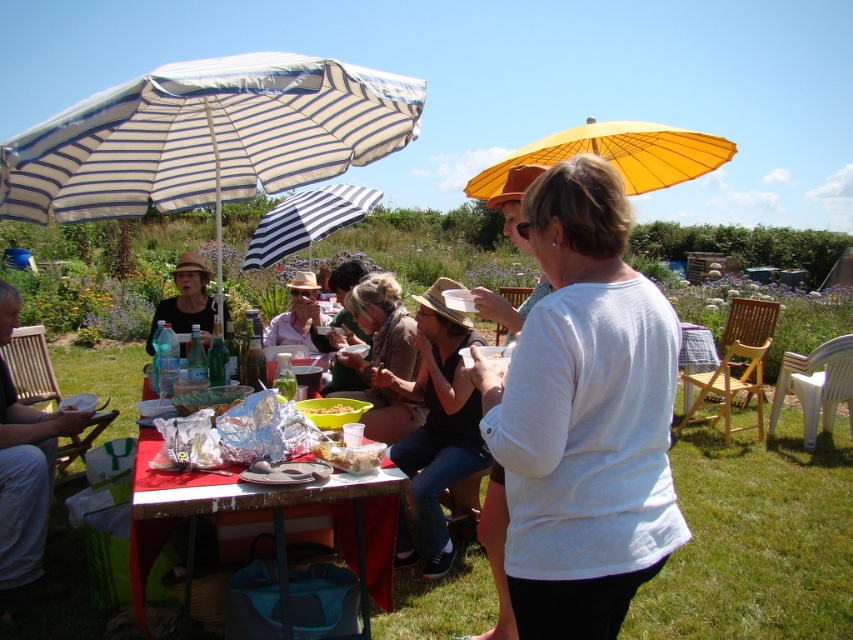
Is striped fabric umbrella at center further to the viewer compared to yellow plastic bowl at center?

Yes, striped fabric umbrella at center is further from the viewer.

Can you confirm if striped fabric umbrella at center is shorter than yellow plastic bowl at center?

In fact, striped fabric umbrella at center may be taller than yellow plastic bowl at center.

This screenshot has width=853, height=640. Describe the element at coordinates (306, 220) in the screenshot. I see `striped fabric umbrella at center` at that location.

Locate an element on the screen. The height and width of the screenshot is (640, 853). striped fabric umbrella at center is located at coordinates (306, 220).

From the picture: Can you confirm if denim jeans at center is positioned to the left of yellow plastic bowl at center?

No, denim jeans at center is not to the left of yellow plastic bowl at center.

Between denim jeans at center and yellow plastic bowl at center, which one has more height?

Standing taller between the two is denim jeans at center.

Is point (424, 502) more distant than point (315, 406)?

Yes.

This screenshot has width=853, height=640. In order to click on denim jeans at center in this screenshot , I will do `click(434, 429)`.

Does white matte shirt at center have a larger size compared to white striped fabric umbrella at upper left?

No, white matte shirt at center is not bigger than white striped fabric umbrella at upper left.

Between point (495, 416) and point (15, 166), which one is positioned behind?

Positioned behind is point (15, 166).

At what (x,y) coordinates should I click in order to perform the action: click on white matte shirt at center. Please return your answer as a coordinate pair (x, y). Looking at the image, I should click on (584, 416).

What are the coordinates of `white matte shirt at center` in the screenshot? It's located at (584, 416).